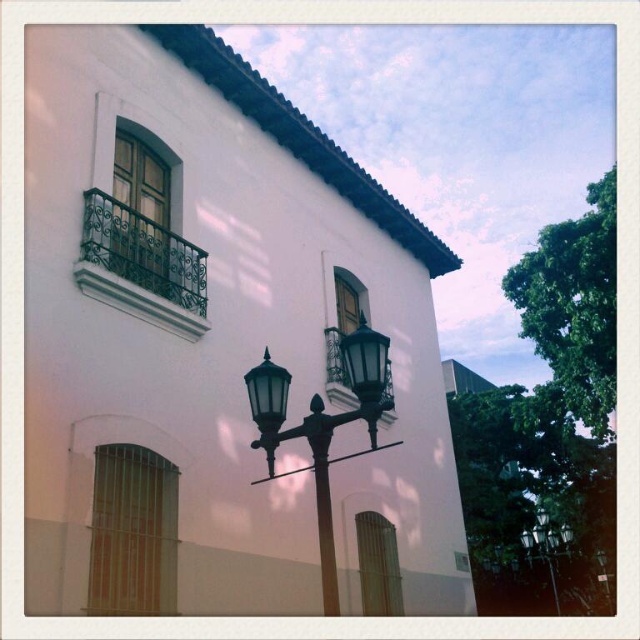
Can you confirm if bronze textured street light at center is smaller than black glass street light at center?

Indeed, bronze textured street light at center has a smaller size compared to black glass street light at center.

Is bronze textured street light at center behind black glass street light at center?

No, bronze textured street light at center is in front of black glass street light at center.

Who is more distant from viewer, (323,472) or (540,538)?

Positioned behind is point (540,538).

Locate an element on the screen. bronze textured street light at center is located at coordinates (323, 426).